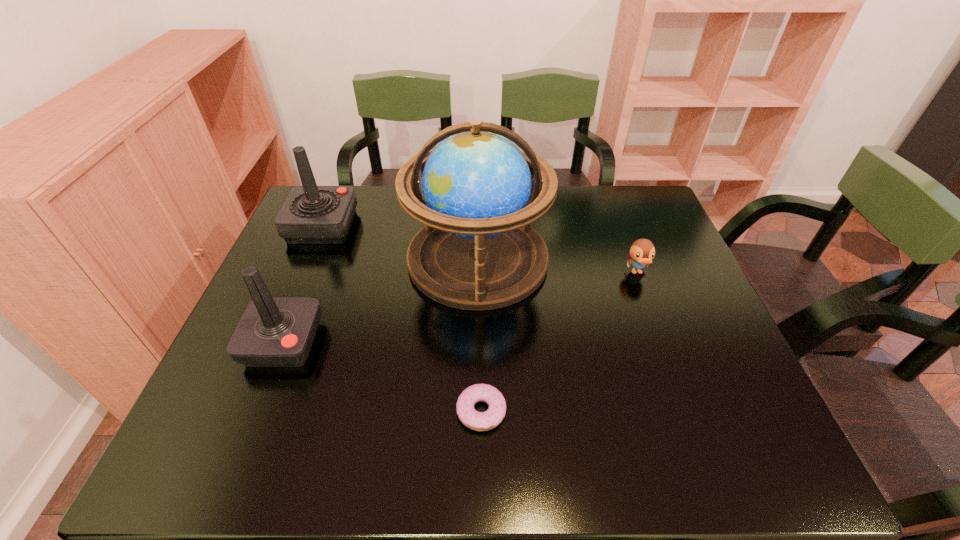
Find the location of `empty space between the tallest object and the duck`. empty space between the tallest object and the duck is located at coordinates (558, 266).

Identify the location of object that is the closest one to the tallest object. The image size is (960, 540). (274, 331).

Locate an element on the screen. This screenshot has height=540, width=960. the fourth closest object to the shortest object is located at coordinates (311, 214).

Image resolution: width=960 pixels, height=540 pixels. What are the coordinates of `vacant area in the image that satisfies the following two spatial constraints: 1. on the front-facing side of the farther joystick; 2. on the back side of the doughnut` in the screenshot? It's located at (246, 411).

The image size is (960, 540). I want to click on vacant space that satisfies the following two spatial constraints: 1. on the front-facing side of the farther joystick; 2. on the back side of the nearest object, so click(x=246, y=411).

You are a GUI agent. You are given a task and a screenshot of the screen. Output one action in this format:
    pyautogui.click(x=<x>, y=<y>)
    Task: Click on the free space in the image that satisfies the following two spatial constraints: 1. on the front-facing side of the farther joystick; 2. on the back side of the nearer joystick
    This screenshot has height=540, width=960.
    Given the screenshot: What is the action you would take?
    pyautogui.click(x=274, y=343)